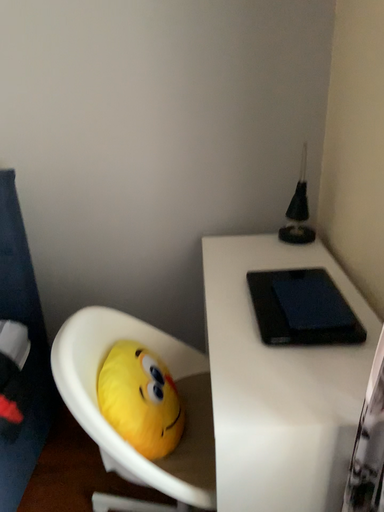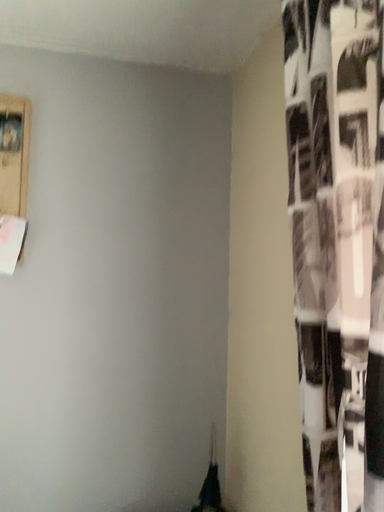
Question: Which way did the camera rotate in the video?

Choices:
 (A) rotated downward
 (B) rotated upward

Answer: (B)